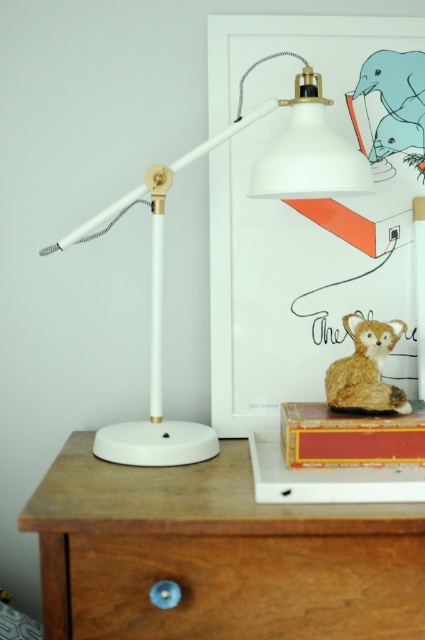
Is wooden drawer at lower center above matte blue elephant at upper right?

No.

Is point (272, 588) positioned before point (422, 104)?

Yes, it is.

Locate an element on the screen. The image size is (425, 640). wooden drawer at lower center is located at coordinates [x=248, y=586].

Consider the image. Is white matte table lamp at center behind matte blue elephant at upper right?

No.

Can you confirm if white matte table lamp at center is positioned to the right of matte blue elephant at upper right?

Incorrect, white matte table lamp at center is not on the right side of matte blue elephant at upper right.

Measure the distance between point [121,448] and camera.

Point [121,448] and camera are 38.31 inches apart.

The height and width of the screenshot is (640, 425). I want to click on white matte table lamp at center, so click(x=251, y=195).

Which is more to the left, matte blue elephant at upper right or fuzzy brown cat at upper right?

From the viewer's perspective, fuzzy brown cat at upper right appears more on the left side.

Measure the distance between matte blue elephant at upper right and camera.

matte blue elephant at upper right is 1.10 meters away from camera.

What do you see at coordinates (396, 100) in the screenshot?
I see `matte blue elephant at upper right` at bounding box center [396, 100].

Identify the location of matte blue elephant at upper right. The width and height of the screenshot is (425, 640). (396, 100).